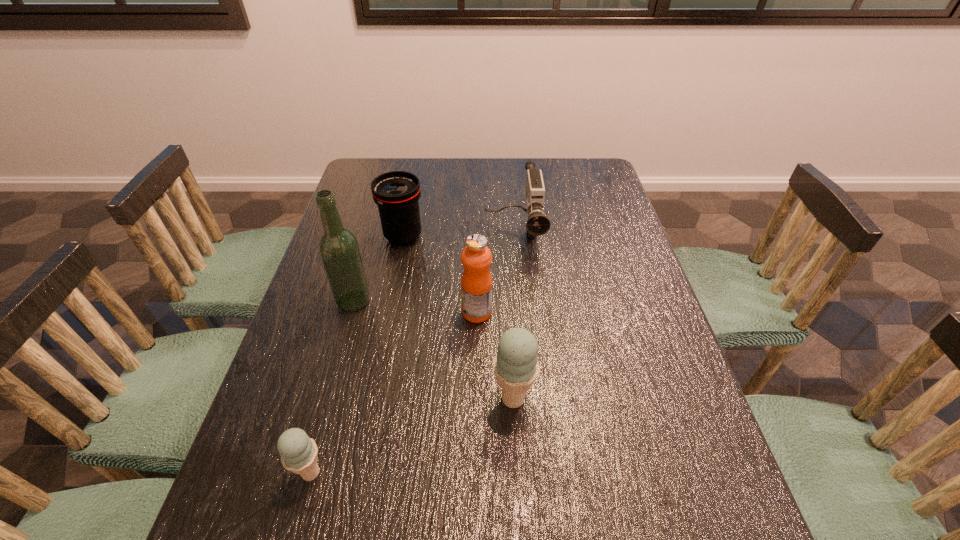
The image size is (960, 540). Find the location of `free space between the liquor and the telephoto lens`. free space between the liquor and the telephoto lens is located at coordinates (378, 269).

Where is `free area in between the fruit juice and the camcorder`? The height and width of the screenshot is (540, 960). free area in between the fruit juice and the camcorder is located at coordinates (495, 274).

Identify the location of blank region between the right ice cream and the tallest object. Image resolution: width=960 pixels, height=540 pixels. (433, 349).

The height and width of the screenshot is (540, 960). I want to click on vacant space that's between the tallest object and the telephoto lens, so click(x=378, y=269).

Identify the location of free space that is in between the farther ice cream and the left ice cream. The height and width of the screenshot is (540, 960). (412, 436).

Locate an element on the screen. This screenshot has height=540, width=960. the second closest object relative to the fruit juice is located at coordinates (516, 366).

Identify which object is the third nearest to the camcorder. Please provide its 2D coordinates. Your answer should be formatted as a tuple, i.e. [(x, y)], where the tuple contains the x and y coordinates of a point satisfying the conditions above.

[(338, 247)]

Find the location of a particular element. free space in the image that satisfies the following two spatial constraints: 1. on the front side of the liquor; 2. on the right side of the fruit juice is located at coordinates (350, 313).

This screenshot has width=960, height=540. What are the coordinates of `vacant space that satisfies the following two spatial constraints: 1. on the front side of the liquor; 2. on the right side of the taller ice cream` in the screenshot? It's located at (326, 399).